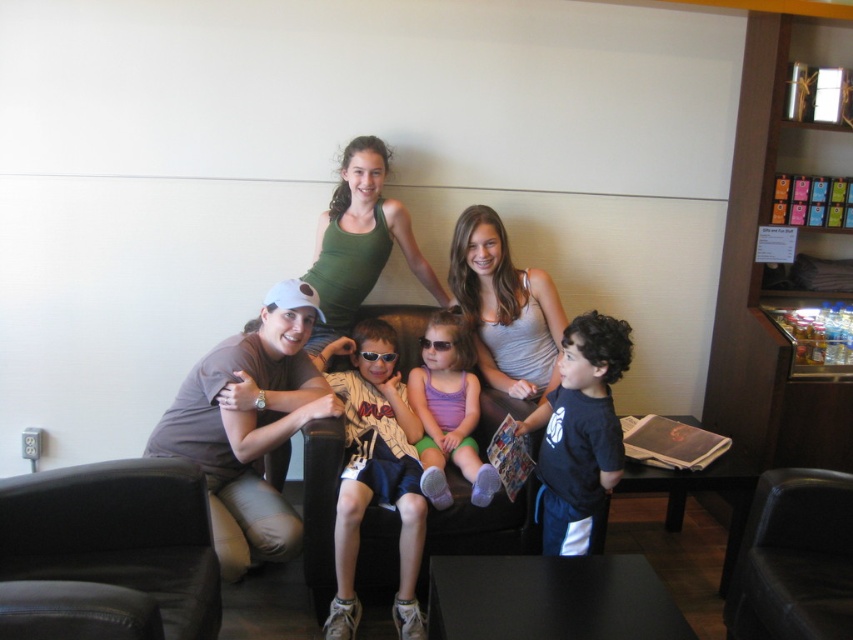
From the picture: You are standing in the room and want to reach both point A at coordinates point (73, 500) and point B at coordinates point (509, 515). Which point should you reach first to minimize the distance walked?

You should reach point A at coordinates point (73, 500) first because it is closer to you than point B at coordinates point (509, 515).